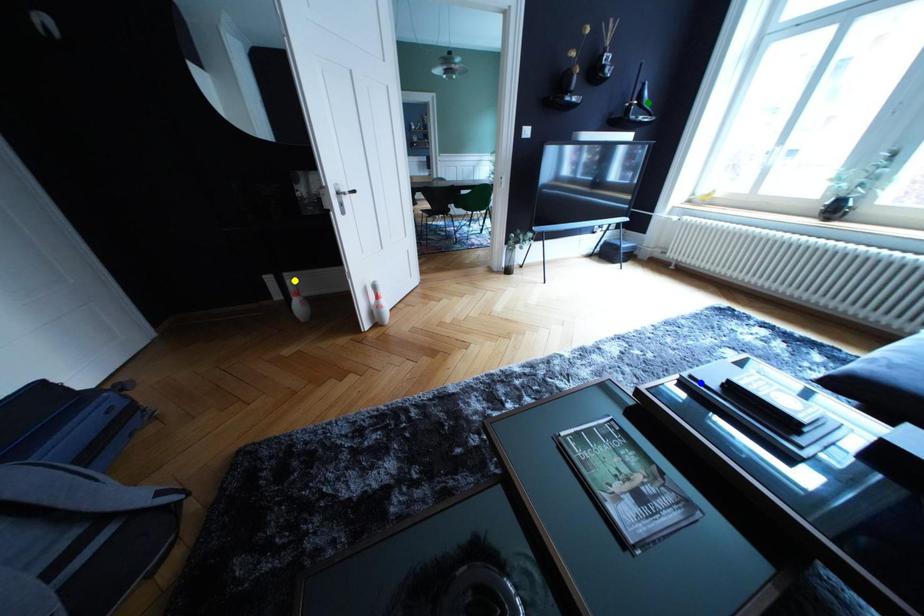
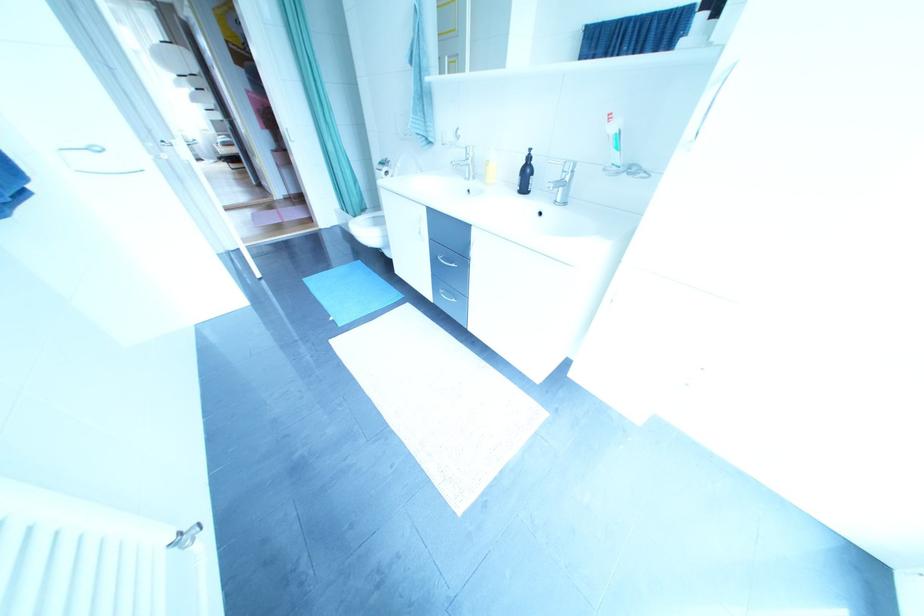
I am providing you with two images of the same scene from different viewpoints. Three points are marked in image1. Which point corresponds to a part or object that is occluded in image2?In image1, three points are marked. Which of them correspond to a part or object that is occluded in image2?Among the three points shown in image1, which one corresponds to a part or object that is no longer visible due to occlusion in image2?

yellow point, blue point, green point cannot be seen in image2.